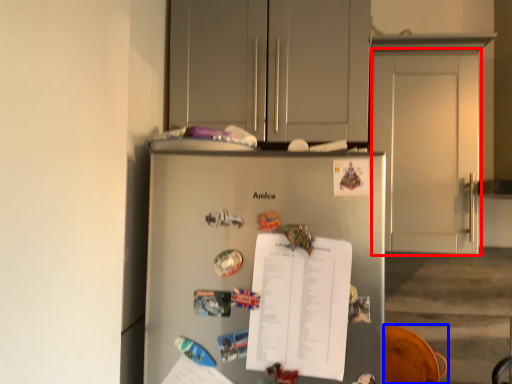
Question: Which object appears closest to the camera in this image, door (highlighted by a red box) or swivel chair (highlighted by a blue box)?

Choices:
 (A) door
 (B) swivel chair

Answer: (A)